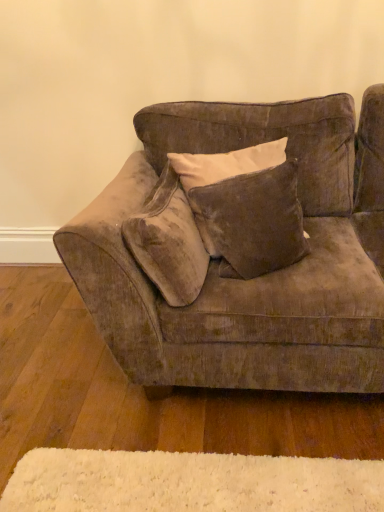
Question: From the image's perspective, is velvet beige pillow at center, the first pillow viewed from the left, below white fluffy mat at lower center?

Choices:
 (A) no
 (B) yes

Answer: (A)

Question: From a real-world perspective, is velvet beige pillow at center, the first pillow viewed from the left, physically above white fluffy mat at lower center?

Choices:
 (A) no
 (B) yes

Answer: (B)

Question: From a real-world perspective, is velvet beige pillow at center, the first pillow viewed from the left, under white fluffy mat at lower center?

Choices:
 (A) no
 (B) yes

Answer: (A)

Question: Is velvet beige pillow at center, the 2th pillow from the right, closer to the viewer compared to white fluffy mat at lower center?

Choices:
 (A) no
 (B) yes

Answer: (A)

Question: Is white fluffy mat at lower center at the back of velvet beige pillow at center, the 2th pillow from the right?

Choices:
 (A) no
 (B) yes

Answer: (A)

Question: Is velvet beige pillow at center, the first pillow viewed from the left, thinner than white fluffy mat at lower center?

Choices:
 (A) no
 (B) yes

Answer: (B)

Question: Does velvet brown couch at center have a greater height compared to white fluffy mat at lower center?

Choices:
 (A) yes
 (B) no

Answer: (A)

Question: Is velvet brown couch at center at the right side of white fluffy mat at lower center?

Choices:
 (A) no
 (B) yes

Answer: (B)

Question: Considering the relative sizes of velvet brown couch at center and white fluffy mat at lower center in the image provided, is velvet brown couch at center bigger than white fluffy mat at lower center?

Choices:
 (A) yes
 (B) no

Answer: (A)

Question: From the image's perspective, would you say velvet brown couch at center is positioned over white fluffy mat at lower center?

Choices:
 (A) no
 (B) yes

Answer: (B)

Question: Does velvet brown couch at center come in front of white fluffy mat at lower center?

Choices:
 (A) yes
 (B) no

Answer: (A)

Question: Is velvet brown couch at center not within white fluffy mat at lower center?

Choices:
 (A) yes
 (B) no

Answer: (A)

Question: From a real-world perspective, is velvet brown pillow at center, which appears as the 2th pillow when viewed from the left, under white fluffy mat at lower center?

Choices:
 (A) no
 (B) yes

Answer: (A)